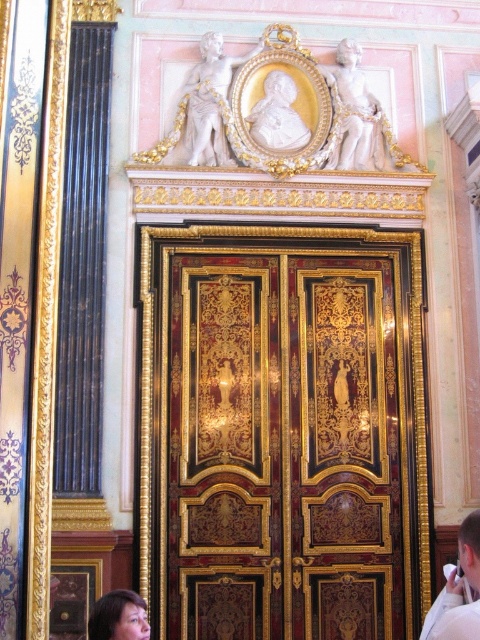
In the scene shown: You are an interior designer assessing the placement of two decorative lights. You need to install one light at point (360, 362) and another at point (437, 634). Considering the depth of the wall, which light will appear closer to visitors entering the room?

The light at point (360, 362) will appear closer to visitors because it is further to the viewer than the light at point (437, 634).

You are standing in the room and want to take a photo of the grand door. The camera you are using has a maximum focus distance of 150 feet. Will the point at coordinates point (176, 592) be in focus if you focus on the grand door?

The point at coordinates point (176, 592) is 147.98 feet from the camera, which is within the maximum focus distance of 150 feet. Therefore, it will be in focus.